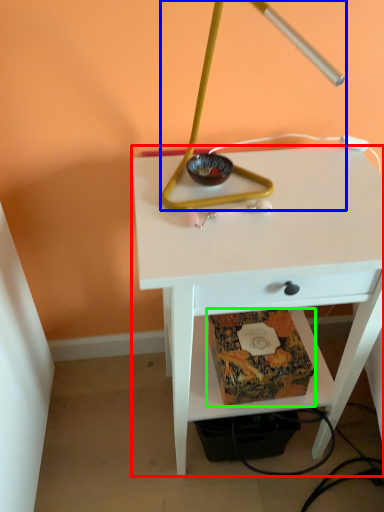
Question: Which is nearer to the table (highlighted by a red box)? lamp (highlighted by a blue box) or paperback book (highlighted by a green box).

Choices:
 (A) lamp
 (B) paperback book

Answer: (B)